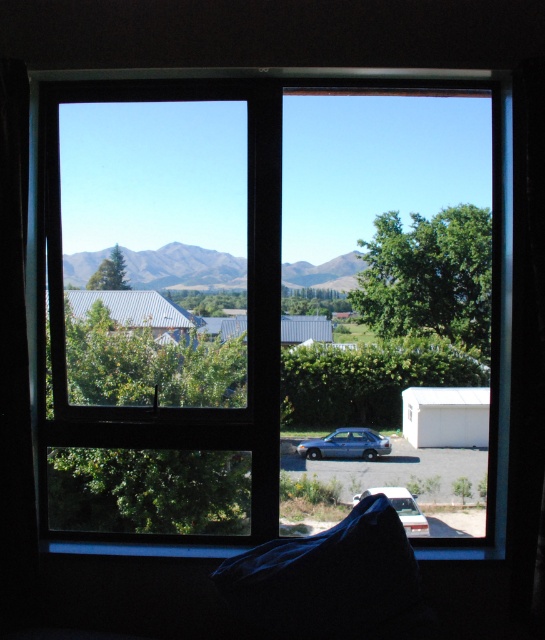
You are standing inside a house and looking through the transparent glass window at center. You notice the green grassy mountain at center in the distance. From your perspective inside, which object is positioned to the right side?

The transparent glass window at center is to the right of green grassy mountain at center, so from your perspective inside the house, the transparent glass window at center is positioned to the right side.

You are standing in a room and looking through the window. You see the green grassy mountain at center and the metallic blue sedan at center. Which object is higher in the scene?

The green grassy mountain at center is higher than the metallic blue sedan at center.

You are standing in a room and looking through the window. The window has two sections. In which section of the window can you see the green grassy mountain at center?

The green grassy mountain at center is located at the upper section of the window because its 2D coordinates are at point (184,268), which falls within the upper section.